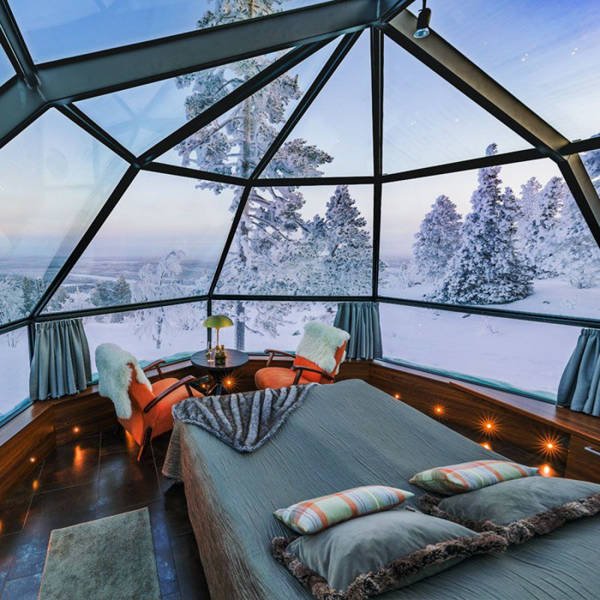
Find the location of a particular element. The image size is (600, 600). grey curtain is located at coordinates (70, 365).